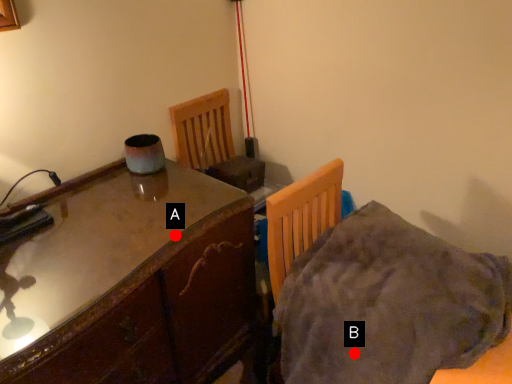
Question: Two points are circled on the image, labeled by A and B beside each circle. Which point is closer to the camera?

Choices:
 (A) A is closer
 (B) B is closer

Answer: (B)